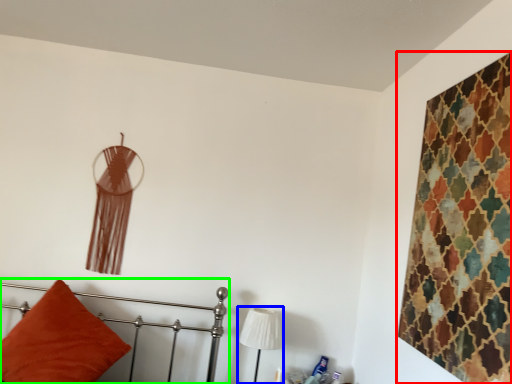
Question: Estimate the real-world distances between objects in this image. Which object is farther from textile (highlighted by a red box), table lamp (highlighted by a blue box) or furniture (highlighted by a green box)?

Choices:
 (A) table lamp
 (B) furniture

Answer: (B)